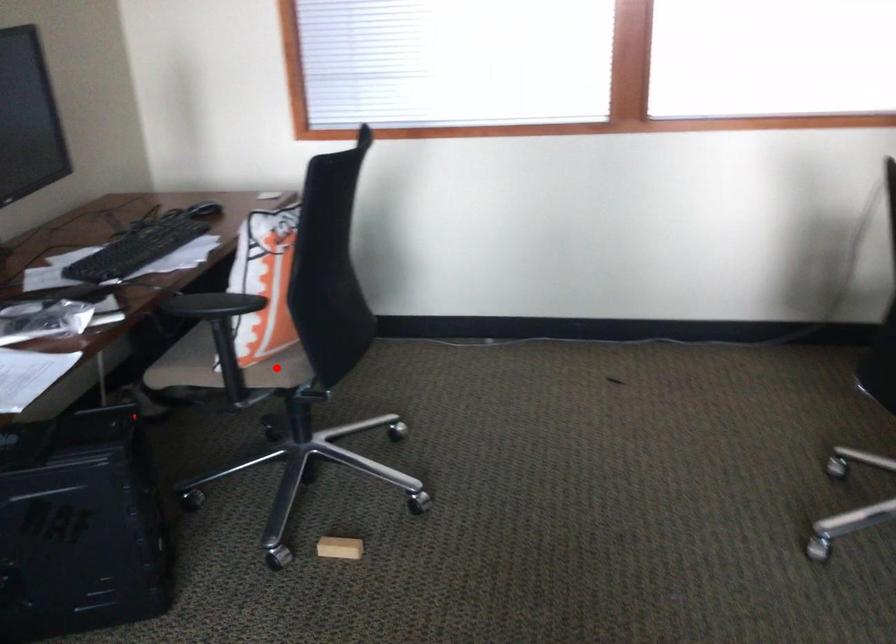
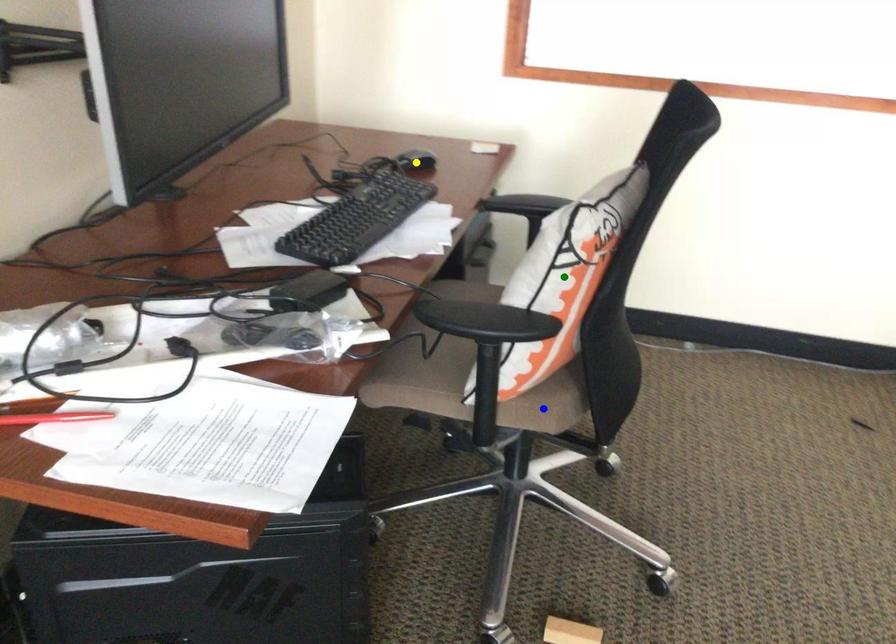
Question: I am providing you with two images of the same scene from different viewpoints. A red point is marked on the first image. You are given multiple points on the second image. Which point in image 2 is actually the same real-world point as the red point in image 1?

Choices:
 (A) blue point
 (B) yellow point
 (C) green point

Answer: (A)